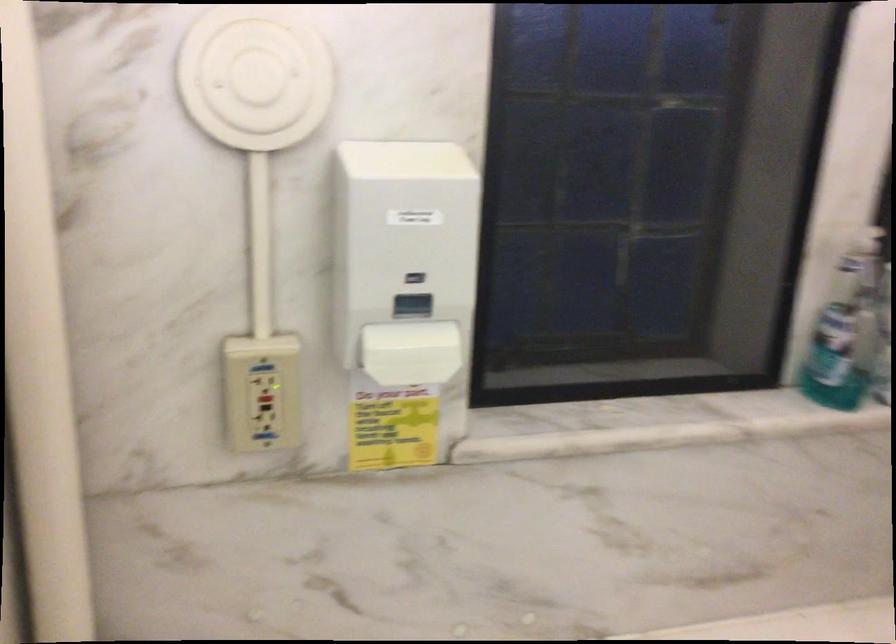
Image resolution: width=896 pixels, height=644 pixels. Identify the location of green plastic bottle. (842, 339).